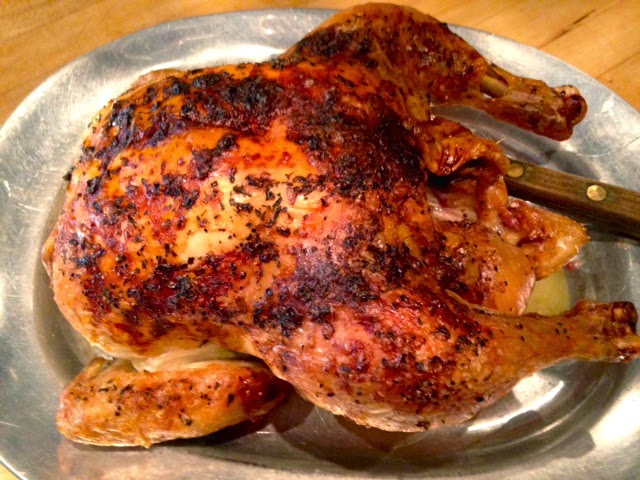
Where is `utensil`? This screenshot has height=480, width=640. utensil is located at coordinates (540, 184).